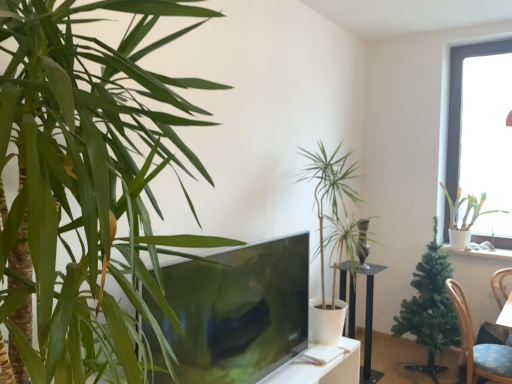
Question: Is transparent glass window at upper right spatially inside green artificial tree at right, which appears as the third houseplant when viewed from the front, or outside of it?

Choices:
 (A) inside
 (B) outside

Answer: (B)

Question: Based on their sizes in the image, would you say transparent glass window at upper right is bigger or smaller than green artificial tree at right, arranged as the second houseplant when viewed from the right?

Choices:
 (A) big
 (B) small

Answer: (B)

Question: Estimate the real-world distances between objects in this image. Which object is closer to the matte black tv at center?

Choices:
 (A) green artificial tree at right, placed as the 2th houseplant when sorted from back to front
 (B) metallic black pedestal at center
 (C) green leafy plant at center, the second houseplant from the front
 (D) white glossy pot at upper right, the first houseplant viewed from the right
 (E) transparent glass window at upper right

Answer: (C)

Question: Estimate the real-world distances between objects in this image. Which object is farther from the blue fabric chair at lower right?

Choices:
 (A) green leafy plant at center, which is the 3th houseplant from back to front
 (B) matte black tv at center
 (C) white glossy pot at upper right, the fourth houseplant viewed from the left
 (D) green artificial tree at right, which appears as the third houseplant when viewed from the front
 (E) metallic black pedestal at center

Answer: (B)